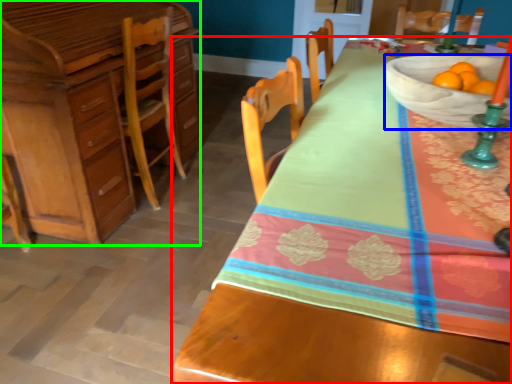
Question: Which is nearer to the desk (highlighted by a red box)? bowl (highlighted by a blue box) or cabinetry (highlighted by a green box).

Choices:
 (A) bowl
 (B) cabinetry

Answer: (A)